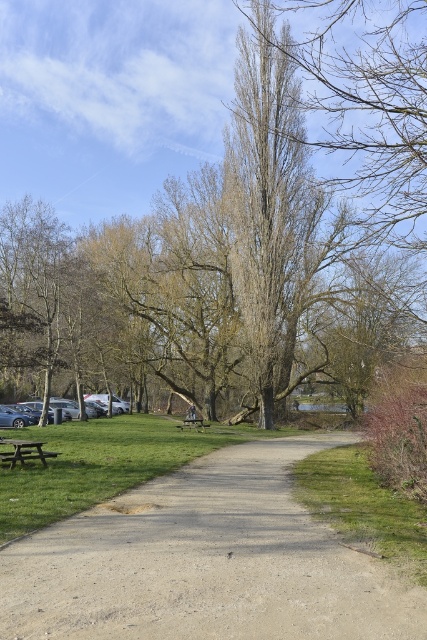
Is the position of green grass at lower left less distant than that of silver metallic car at lower left?

Yes.

Is green grass at lower left further to camera compared to silver metallic car at lower left?

No, green grass at lower left is in front of silver metallic car at lower left.

This screenshot has width=427, height=640. In order to click on green grass at lower left in this screenshot , I will do `click(102, 465)`.

At what (x,y) coordinates should I click in order to perform the action: click on green grass at lower left. Please return your answer as a coordinate pair (x, y). The height and width of the screenshot is (640, 427). Looking at the image, I should click on (102, 465).

Does brown textured tree at center come behind green grass at lower left?

Yes, brown textured tree at center is further from the viewer.

Who is positioned more to the right, brown textured tree at center or green grass at lower left?

green grass at lower left is more to the right.

The width and height of the screenshot is (427, 640). Describe the element at coordinates (222, 205) in the screenshot. I see `brown textured tree at center` at that location.

The image size is (427, 640). I want to click on brown textured tree at center, so click(222, 205).

Based on the photo, is brown textured tree at center closer to camera compared to silver metallic car at lower left?

Yes, it is.

Is brown textured tree at center below silver metallic car at lower left?

No.

Is point (284, 336) positioned in front of point (31, 403)?

Yes, point (284, 336) is closer to viewer.

Where is `brown textured tree at center`? Image resolution: width=427 pixels, height=640 pixels. brown textured tree at center is located at coordinates (222, 205).